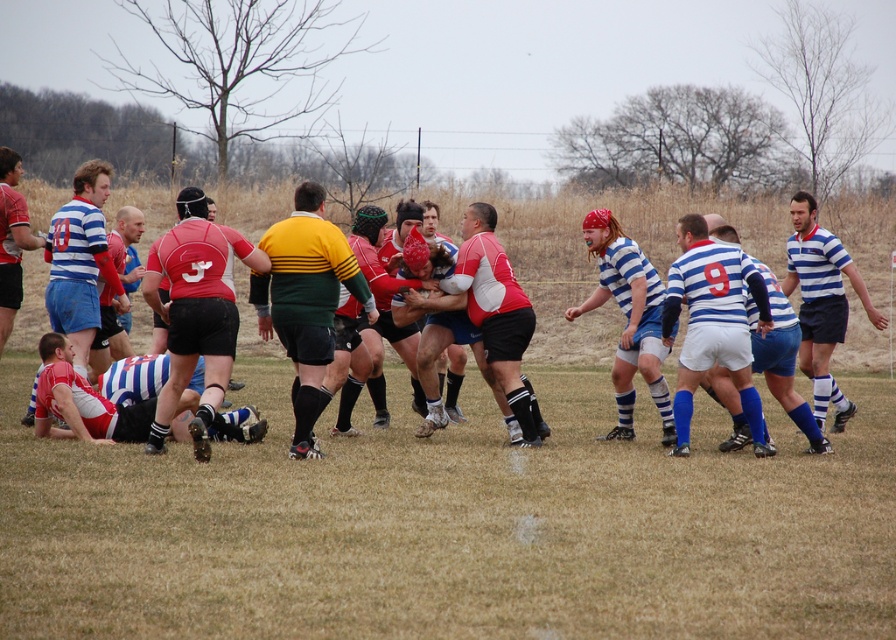
You are a photographer standing at the edge of the field. You want to take a closeup shot of the blue striped jersey at center. Given that your camera can focus on objects up to 30 feet away, will you be able to capture the jersey clearly?

The blue striped jersey at center is 31.15 feet away from the viewer. Since the camera can only focus up to 30 feet, the photographer will not be able to capture the jersey clearly without moving closer.